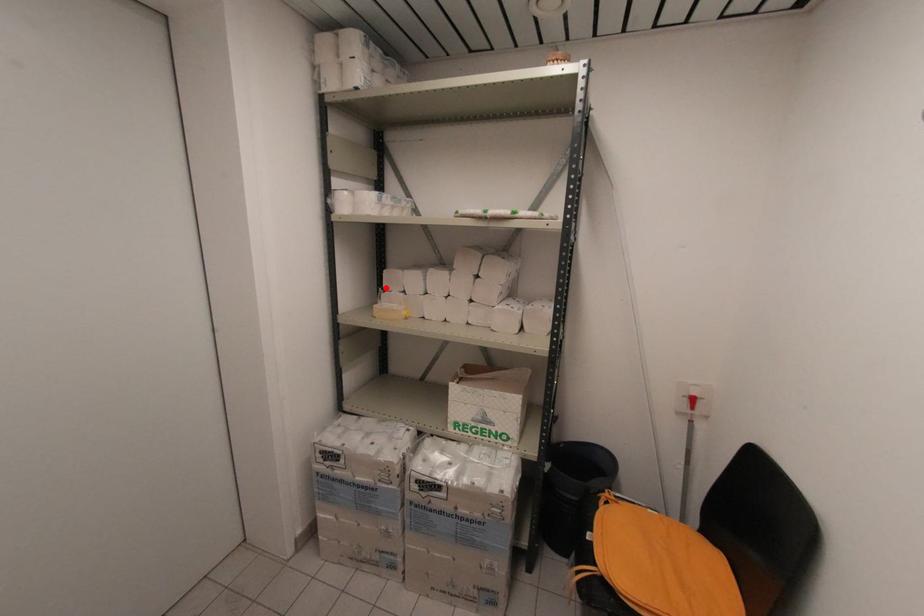
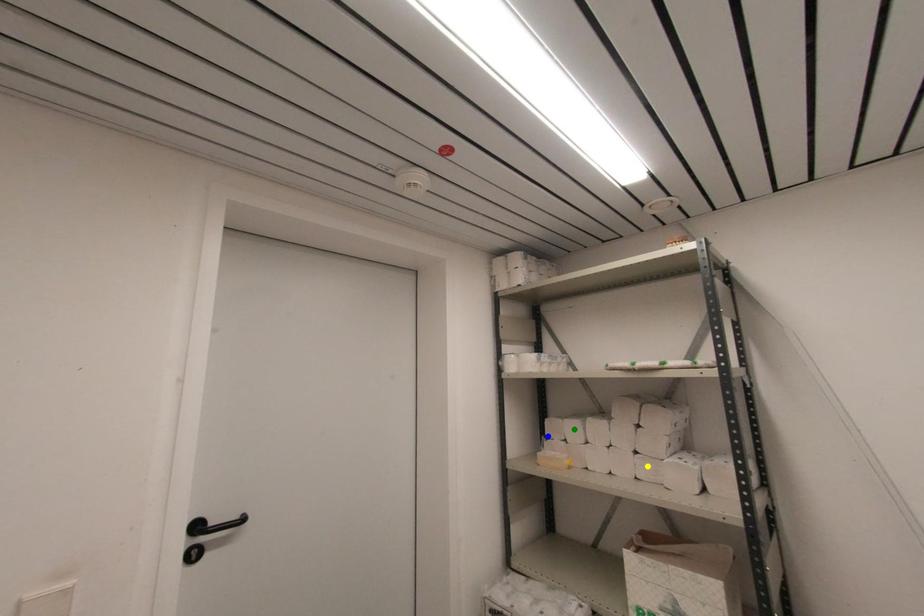
Question: I am providing you with two images of the same scene from different viewpoints. A red point is marked on the first image. You are given multiple points on the second image. Which point in image 2 is actually the same real-world point as the red point in image 1?

Choices:
 (A) blue point
 (B) green point
 (C) yellow point

Answer: (A)